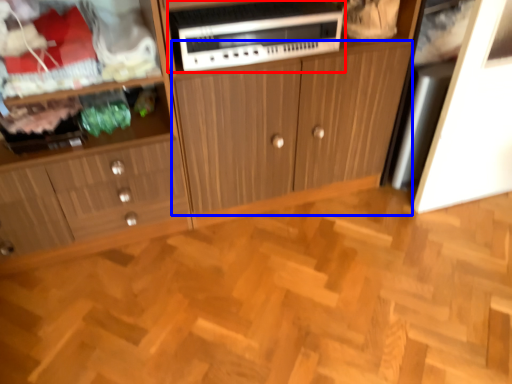
Question: Which object is closer to the camera taking this photo, home appliance (highlighted by a red box) or cabinetry (highlighted by a blue box)?

Choices:
 (A) home appliance
 (B) cabinetry

Answer: (B)